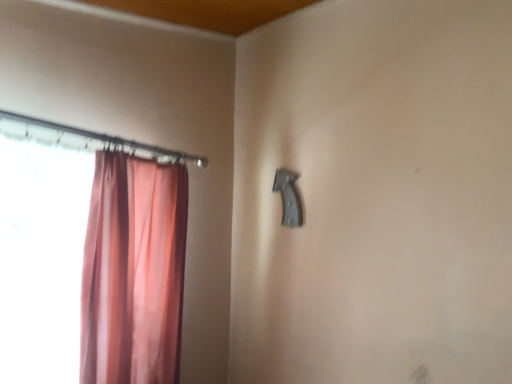
Question: Should I look upward or downward to see pink sheer curtain at left?

Choices:
 (A) up
 (B) down

Answer: (B)

Question: Is matte black door handle at upper center directly adjacent to pink sheer curtain at left?

Choices:
 (A) yes
 (B) no

Answer: (B)

Question: Considering the relative sizes of matte black door handle at upper center and pink sheer curtain at left in the image provided, is matte black door handle at upper center wider than pink sheer curtain at left?

Choices:
 (A) yes
 (B) no

Answer: (B)

Question: Is matte black door handle at upper center positioned in front of pink sheer curtain at left?

Choices:
 (A) no
 (B) yes

Answer: (A)

Question: Would you say pink sheer curtain at left is part of matte black door handle at upper center's contents?

Choices:
 (A) yes
 (B) no

Answer: (B)

Question: Can you confirm if matte black door handle at upper center is bigger than pink sheer curtain at left?

Choices:
 (A) yes
 (B) no

Answer: (B)

Question: Is matte black door handle at upper center smaller than pink sheer curtain at left?

Choices:
 (A) no
 (B) yes

Answer: (B)

Question: Considering the relative sizes of pink sheer curtain at left and matte black door handle at upper center in the image provided, is pink sheer curtain at left smaller than matte black door handle at upper center?

Choices:
 (A) no
 (B) yes

Answer: (A)

Question: Is pink sheer curtain at left placed right next to matte black door handle at upper center?

Choices:
 (A) no
 (B) yes

Answer: (A)

Question: Is pink sheer curtain at left wider than matte black door handle at upper center?

Choices:
 (A) no
 (B) yes

Answer: (B)

Question: Could you tell me if pink sheer curtain at left is turned towards matte black door handle at upper center?

Choices:
 (A) no
 (B) yes

Answer: (A)

Question: Is pink sheer curtain at left located outside matte black door handle at upper center?

Choices:
 (A) no
 (B) yes

Answer: (B)

Question: Does pink sheer curtain at left come in front of matte black door handle at upper center?

Choices:
 (A) no
 (B) yes

Answer: (B)

Question: In terms of width, does pink sheer curtain at left look wider or thinner when compared to matte black door handle at upper center?

Choices:
 (A) wide
 (B) thin

Answer: (A)